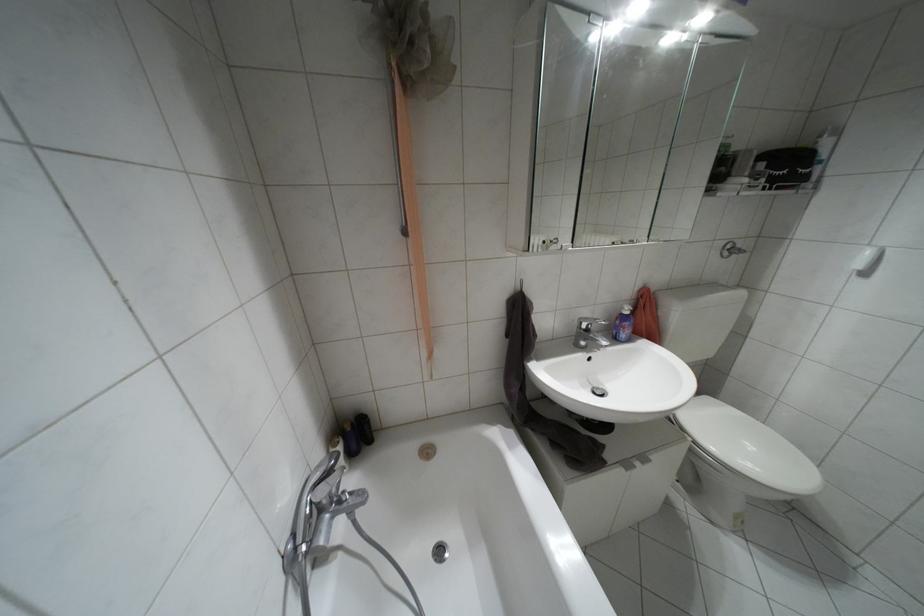
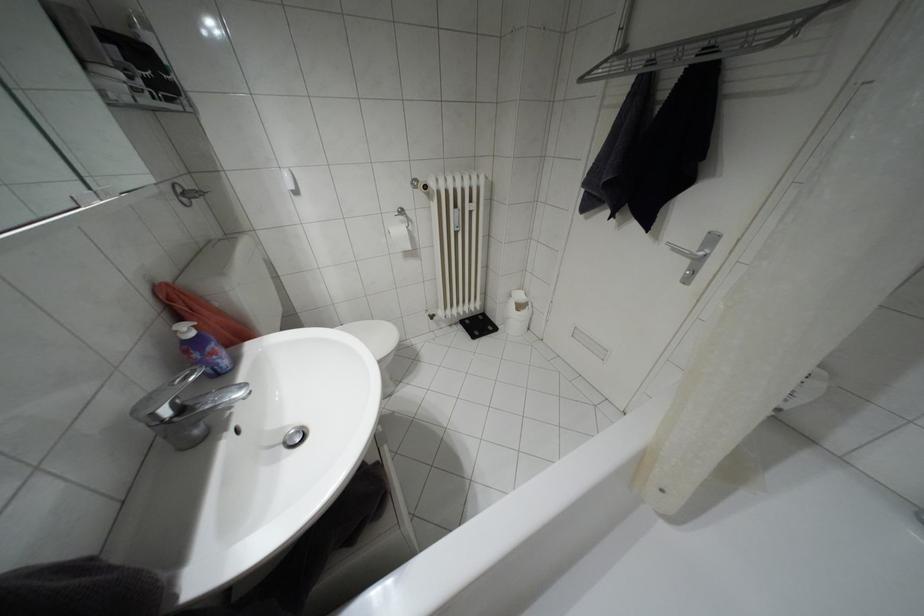
In the second image, find the point that corresponds to pixel 626 312 in the first image.

(190, 333)